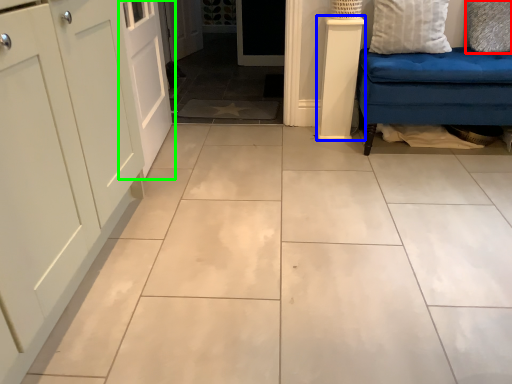
Question: Which is farther away from pillow (highlighted by a red box)? pillar (highlighted by a blue box) or door (highlighted by a green box)?

Choices:
 (A) pillar
 (B) door

Answer: (B)